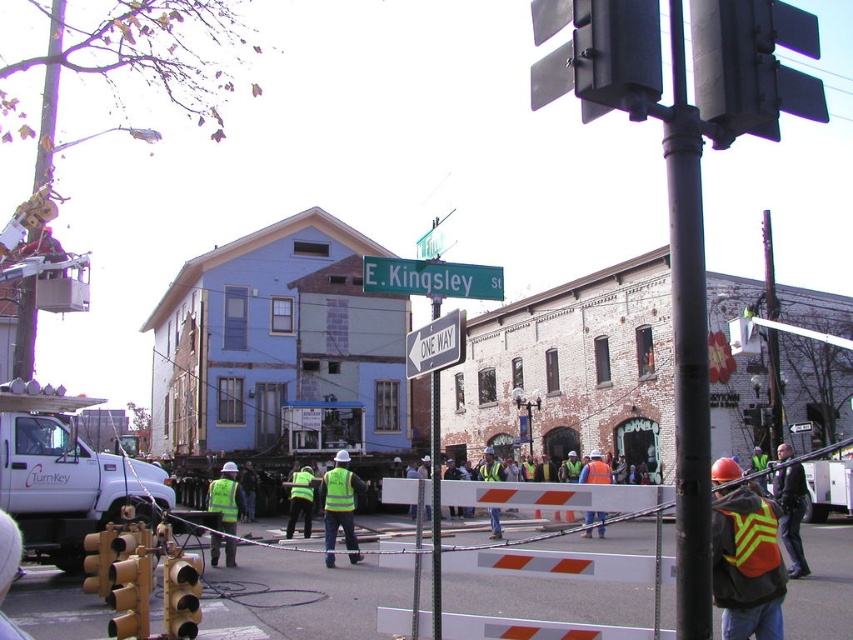
Between yellow matte traffic light at lower left and reflective orange vest at lower right, which one appears on the left side from the viewer's perspective?

Positioned to the left is yellow matte traffic light at lower left.

Is the position of yellow matte traffic light at lower left more distant than that of reflective orange vest at lower right?

Yes, yellow matte traffic light at lower left is further from the viewer.

I want to click on yellow matte traffic light at lower left, so click(x=181, y=595).

Which is above, reflective yellow-green safety vest at lower right or reflective orange vest at lower right?

Positioned higher is reflective yellow-green safety vest at lower right.

What do you see at coordinates (753, 540) in the screenshot?
I see `reflective yellow-green safety vest at lower right` at bounding box center [753, 540].

This screenshot has height=640, width=853. Describe the element at coordinates (753, 540) in the screenshot. I see `reflective yellow-green safety vest at lower right` at that location.

Where is `reflective yellow-green safety vest at lower right`? The width and height of the screenshot is (853, 640). reflective yellow-green safety vest at lower right is located at coordinates (x=753, y=540).

Does green metallic street sign at center appear on the right side of reflective yellow safety vest at center?

Indeed, green metallic street sign at center is positioned on the right side of reflective yellow safety vest at center.

In the scene shown: Is green metallic street sign at center below reflective yellow safety vest at center?

No, green metallic street sign at center is not below reflective yellow safety vest at center.

Between point (502, 289) and point (238, 500), which one is positioned in front?

Point (502, 289)

Locate an element on the screen. The width and height of the screenshot is (853, 640). green metallic street sign at center is located at coordinates (431, 278).